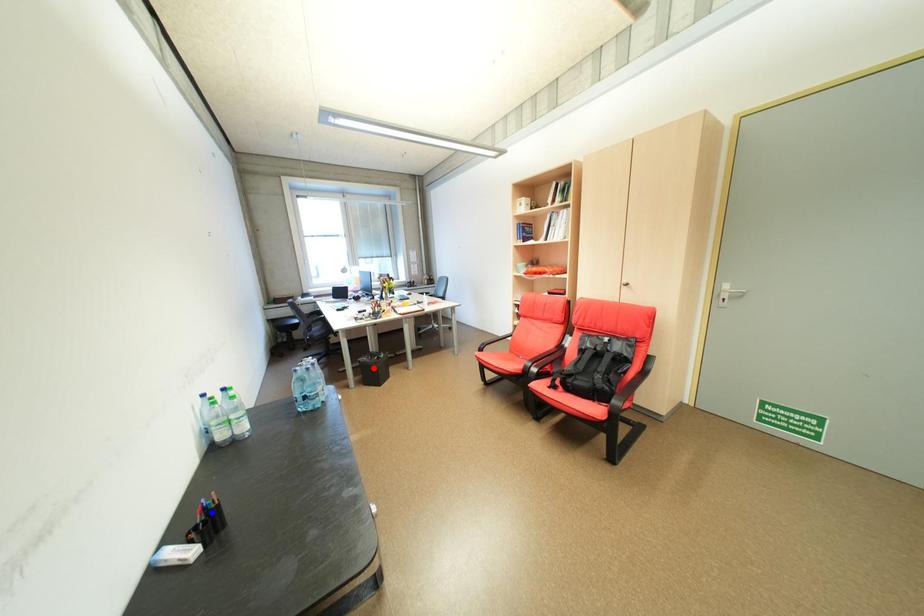
Question: In the image, two points are highlighted. Which point is nearer to the camera? Reply with the corresponding letter.

Choices:
 (A) blue point
 (B) red point

Answer: (A)